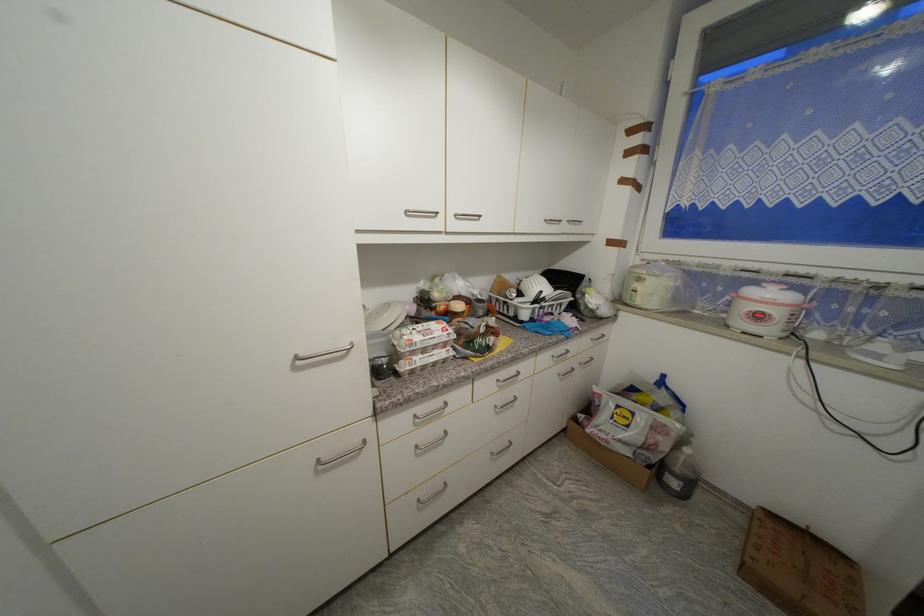
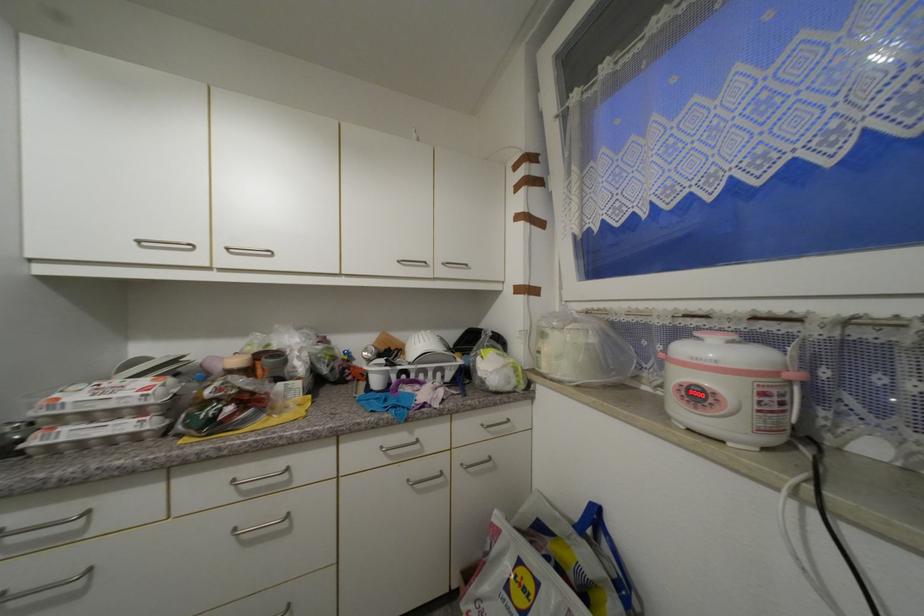
Locate, in the second image, the point that corresponds to the point at 530,317 in the first image.

(382, 384)